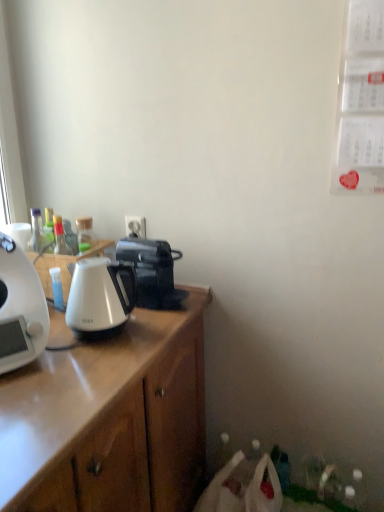
Where is `vacant point above white glossy kettle at left (from a real-world perspective)`? vacant point above white glossy kettle at left (from a real-world perspective) is located at coordinates (93, 266).